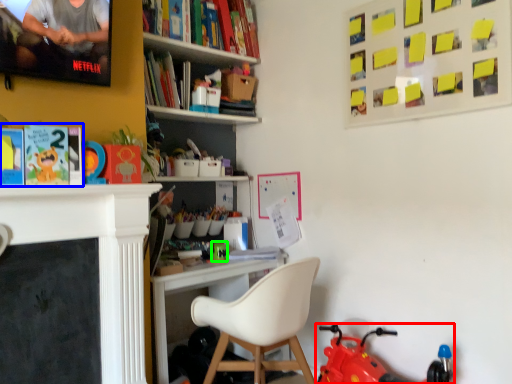
Question: Which object is positioned closest to toy (highlighted by a red box)? Select from book (highlighted by a blue box) and toy (highlighted by a green box).

Choices:
 (A) book
 (B) toy

Answer: (B)